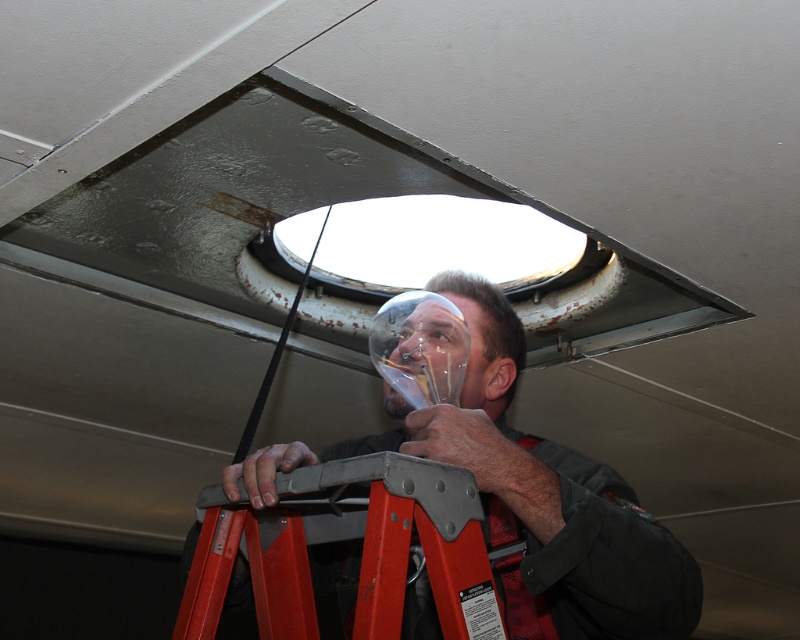
Question: Does clear plastic lightbulb at center appear on the right side of red metallic ladder at lower center?

Choices:
 (A) no
 (B) yes

Answer: (B)

Question: From the image, what is the correct spatial relationship of clear plastic lightbulb at center in relation to red metallic ladder at lower center?

Choices:
 (A) below
 (B) above

Answer: (B)

Question: Does clear plastic lightbulb at center have a greater width compared to red metallic ladder at lower center?

Choices:
 (A) yes
 (B) no

Answer: (A)

Question: Which point is closer to the camera?

Choices:
 (A) red metallic ladder at lower center
 (B) clear plastic lightbulb at center

Answer: (A)